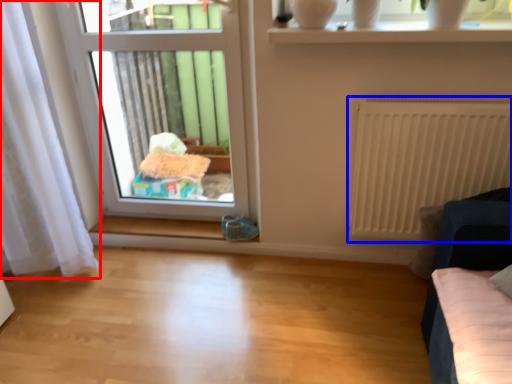
Question: Which of the following is the closest to the observer, curtain (highlighted by a red box) or radiator (highlighted by a blue box)?

Choices:
 (A) curtain
 (B) radiator

Answer: (A)